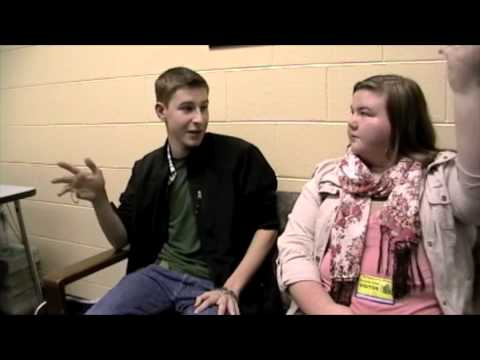
Identify the location of wall. click(x=110, y=123).